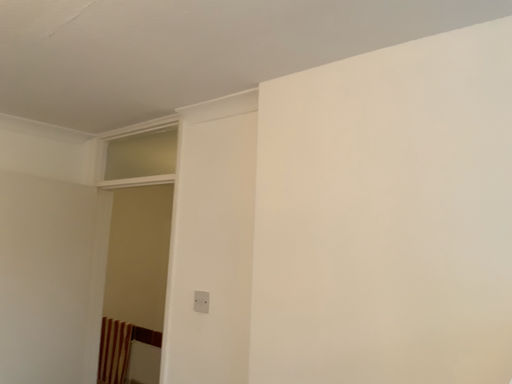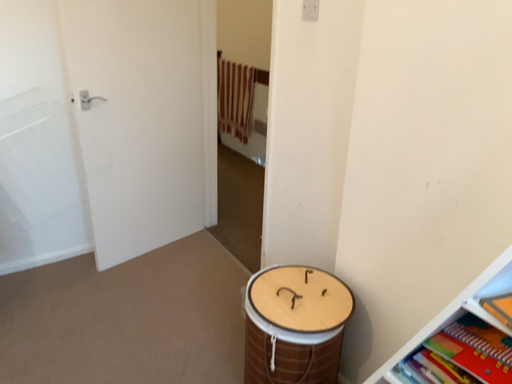
Question: Which way did the camera rotate in the video?

Choices:
 (A) rotated left
 (B) rotated right

Answer: (A)